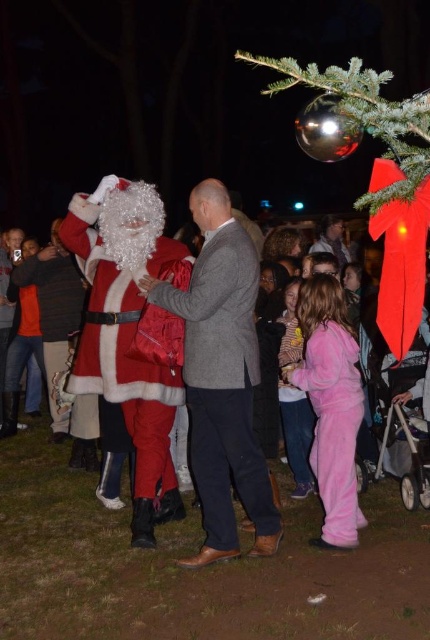
Who is positioned more to the right, fuzzy red santa at left or pink fleece pajamas at lower right?

pink fleece pajamas at lower right

Who is lower down, fuzzy red santa at left or pink fleece pajamas at lower right?

pink fleece pajamas at lower right

Between point (137, 186) and point (344, 467), which one is positioned in front?

Point (344, 467)

This screenshot has height=640, width=430. I want to click on fuzzy red santa at left, so click(128, 333).

Is point (211, 528) behind point (103, 221)?

That is False.

Does matte gray suit at center have a greater height compared to fuzzy red santa at left?

In fact, matte gray suit at center may be shorter than fuzzy red santa at left.

Is point (166, 282) farther from viewer compared to point (128, 241)?

That is False.

Image resolution: width=430 pixels, height=640 pixels. Identify the location of matte gray suit at center. (221, 378).

Does pink fleece pajamas at lower right have a lesser width compared to pink fleece pants at lower center?

No.

Which is behind, point (349, 481) or point (289, 336)?

The point (289, 336) is behind.

The width and height of the screenshot is (430, 640). What are the coordinates of `pink fleece pajamas at lower right` in the screenshot? It's located at (331, 404).